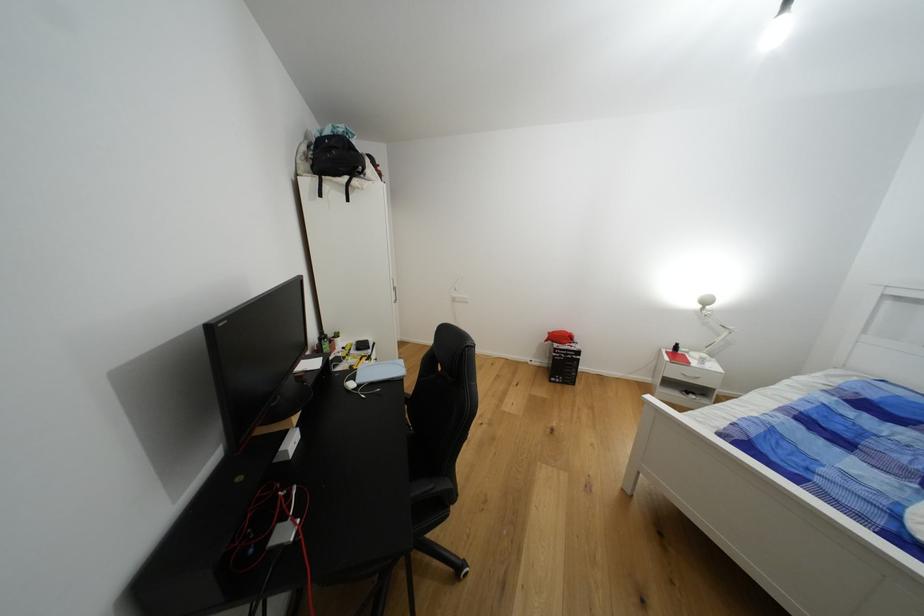
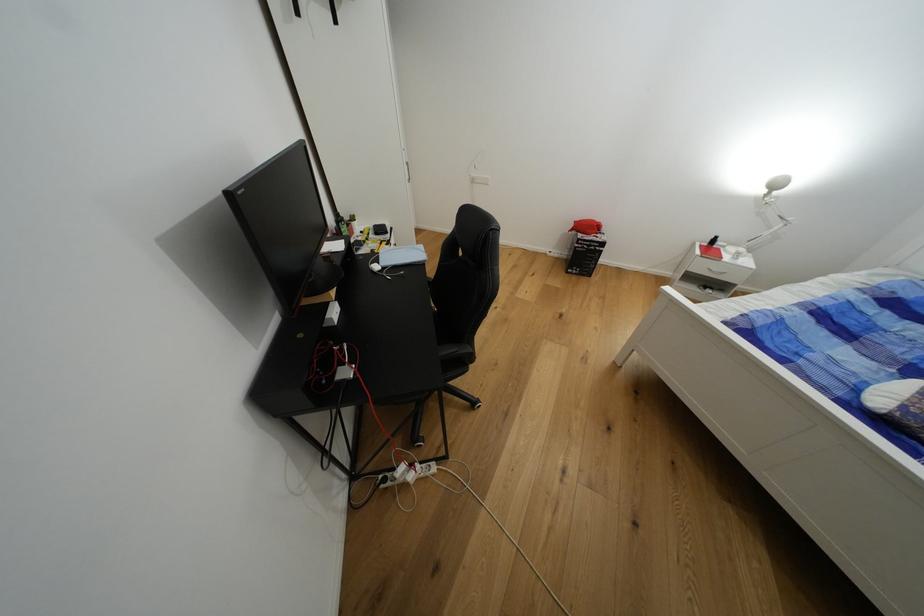
Where in the second image is the point corresponding to (x=359, y=379) from the first image?

(383, 262)